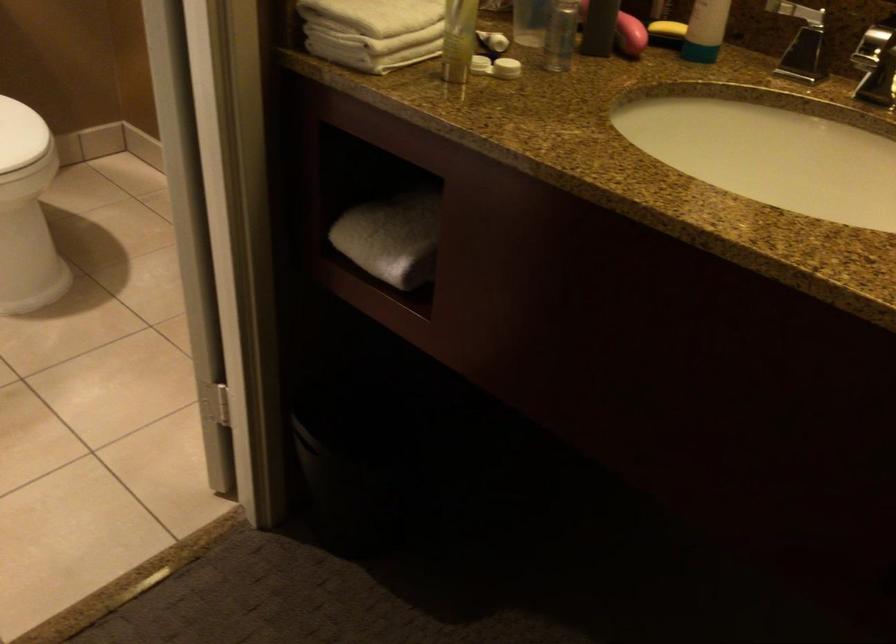
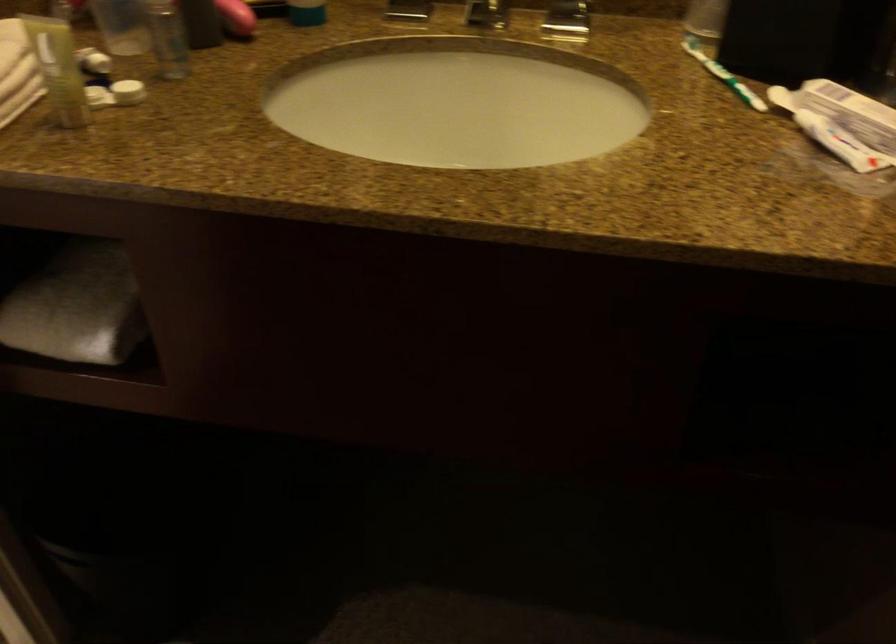
Locate, in the second image, the point that corresponds to the point at 813,171 in the first image.

(457, 102)